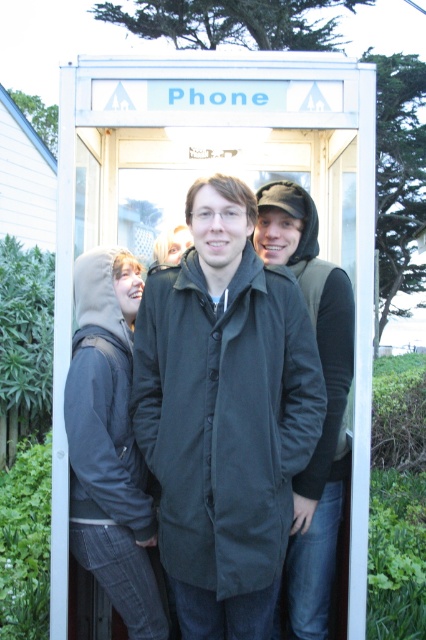
Question: Which object is positioned closest to the dark gray hoodie at center?

Choices:
 (A) black matte coat at center
 (B) metallic phone booth at center

Answer: (A)

Question: Can you confirm if black matte coat at center is bigger than dark gray hoodie at center?

Choices:
 (A) no
 (B) yes

Answer: (B)

Question: Considering the real-world distances, which object is farthest from the metallic phone booth at center?

Choices:
 (A) black matte coat at center
 (B) dark gray hoodie at center

Answer: (B)

Question: Is metallic phone booth at center positioned at the back of dark gray hoodie at center?

Choices:
 (A) yes
 (B) no

Answer: (B)

Question: Which point appears closest to the camera in this image?

Choices:
 (A) (293, 580)
 (B) (209, 513)

Answer: (B)

Question: Can you confirm if dark gray hoodie at center is bigger than matte black coat at center?

Choices:
 (A) yes
 (B) no

Answer: (B)